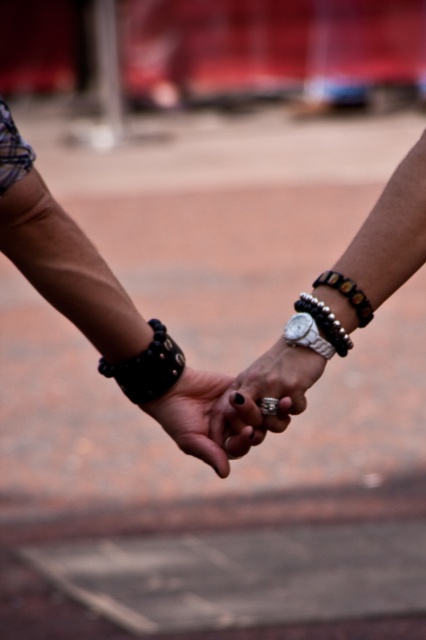
You are a photographer focusing on the two hands in the image. You notice the black leather bracelet at center and the leather studded bracelet at center. Which bracelet is located to the left of the other?

The black leather bracelet at center is positioned on the left side of the leather studded bracelet at center.

You are a jeweler examining two bracelets on a customer. The customer has a leather studded bracelet at center and a black beaded bracelet at center. Which bracelet is taller?

The leather studded bracelet at center is taller than the black beaded bracelet at center.

You are a jeweler examining two accessories on a customer. The customer has a black leather bracelet at center and a silver metallic watch at center. Which accessory takes up more space?

The black leather bracelet at center is bigger than the silver metallic watch at center, so it takes up more space.